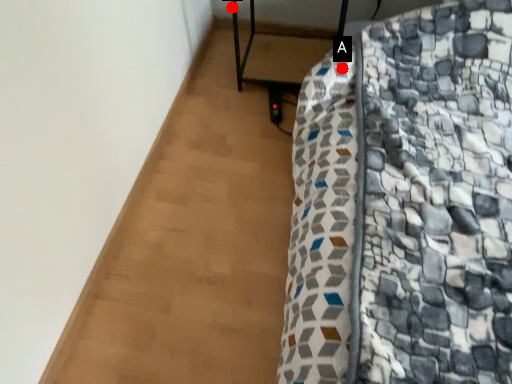
Question: Two points are circled on the image, labeled by A and B beside each circle. Which point is closer to the camera?

Choices:
 (A) A is closer
 (B) B is closer

Answer: (A)